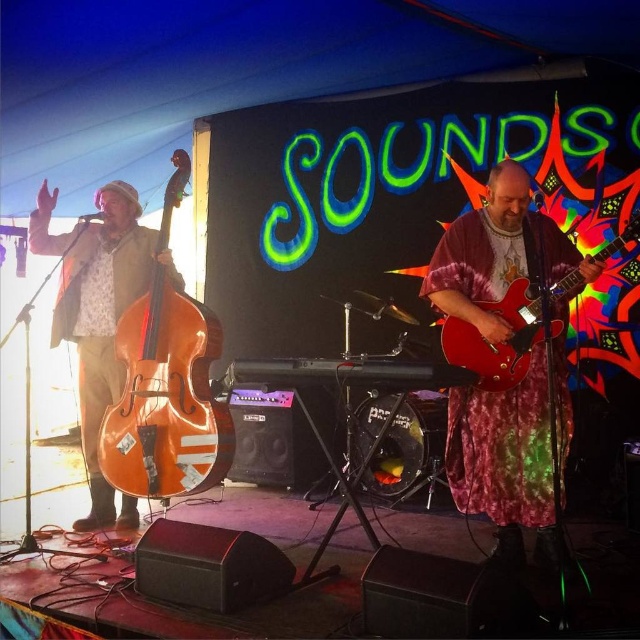
Question: In this image, where is natural wood bass at left located relative to glossy wood guitar at center?

Choices:
 (A) above
 (B) below

Answer: (B)

Question: Which object is the farthest from the glossy wood guitar at center?

Choices:
 (A) natural wood bass at left
 (B) matte brown double bass at left

Answer: (B)

Question: Is shiny red guitar at center to the left of natural wood bass at left from the viewer's perspective?

Choices:
 (A) no
 (B) yes

Answer: (A)

Question: Which object appears farthest from the camera in this image?

Choices:
 (A) shiny red guitar at center
 (B) natural wood bass at left

Answer: (B)

Question: Estimate the real-world distances between objects in this image. Which object is farther from the natural wood bass at left?

Choices:
 (A) matte brown double bass at left
 (B) shiny red guitar at center
 (C) glossy wood guitar at center

Answer: (C)

Question: Is shiny red guitar at center thinner than glossy wood guitar at center?

Choices:
 (A) yes
 (B) no

Answer: (A)